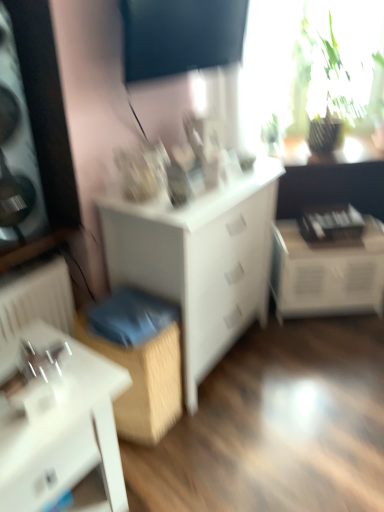
Question: Is dark matte screen at upper center, the 2th window screen positioned from the right, located outside wooden box at lower center?

Choices:
 (A) yes
 (B) no

Answer: (A)

Question: Is dark matte screen at upper center, which ranks as the second window screen in back-to-front order, with wooden box at lower center?

Choices:
 (A) yes
 (B) no

Answer: (B)

Question: Does dark matte screen at upper center, which appears as the first window screen when viewed from the front, have a lesser height compared to wooden box at lower center?

Choices:
 (A) no
 (B) yes

Answer: (B)

Question: Does dark matte screen at upper center, which ranks as the second window screen in back-to-front order, have a greater width compared to wooden box at lower center?

Choices:
 (A) no
 (B) yes

Answer: (A)

Question: Is dark matte screen at upper center, which ranks as the second window screen in back-to-front order, smaller than wooden box at lower center?

Choices:
 (A) no
 (B) yes

Answer: (B)

Question: From the image's perspective, is white glossy table at lower left, marked as the first table in a left-to-right arrangement, above or below green leafy plant at upper right, marked as the 2th window screen in a left-to-right arrangement?

Choices:
 (A) above
 (B) below

Answer: (B)

Question: Visually, is white glossy table at lower left, marked as the first table in a left-to-right arrangement, positioned to the left or to the right of green leafy plant at upper right, which is counted as the second window screen, starting from the front?

Choices:
 (A) left
 (B) right

Answer: (A)

Question: From a real-world perspective, is white glossy table at lower left, the 2th table when ordered from back to front, above or below green leafy plant at upper right, the first window screen in the back-to-front sequence?

Choices:
 (A) above
 (B) below

Answer: (B)

Question: Looking at the image, does white glossy table at lower left, the 2th table when ordered from back to front, seem bigger or smaller compared to green leafy plant at upper right, which is counted as the second window screen, starting from the front?

Choices:
 (A) small
 (B) big

Answer: (A)

Question: Visually, is wooden box at lower center positioned to the left or to the right of dark matte screen at upper center, which ranks as the second window screen in back-to-front order?

Choices:
 (A) left
 (B) right

Answer: (A)

Question: In the image, is wooden box at lower center positioned in front of or behind dark matte screen at upper center, which ranks as the second window screen in back-to-front order?

Choices:
 (A) behind
 (B) front

Answer: (A)

Question: In terms of height, does wooden box at lower center look taller or shorter compared to dark matte screen at upper center, which ranks as the second window screen in back-to-front order?

Choices:
 (A) tall
 (B) short

Answer: (A)

Question: In terms of size, does wooden box at lower center appear bigger or smaller than dark matte screen at upper center, which ranks as the second window screen in back-to-front order?

Choices:
 (A) small
 (B) big

Answer: (B)

Question: Is dark matte screen at upper center, which ranks as the second window screen in back-to-front order, wider or thinner than green leafy plant at upper right, the first window screen in the back-to-front sequence?

Choices:
 (A) thin
 (B) wide

Answer: (A)

Question: In terms of height, does dark matte screen at upper center, placed as the first window screen when sorted from left to right, look taller or shorter compared to green leafy plant at upper right, which appears as the first window screen when viewed from the right?

Choices:
 (A) tall
 (B) short

Answer: (B)